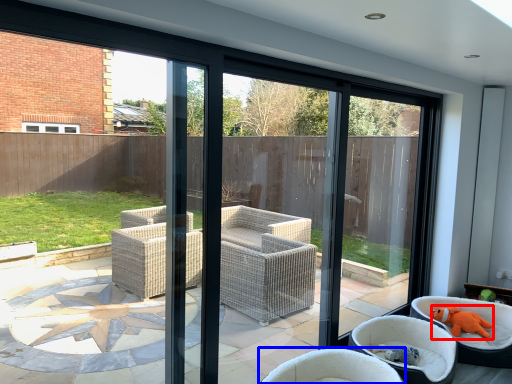
Question: Among these objects, which one is farthest to the camera, animal (highlighted by a red box) or chair (highlighted by a blue box)?

Choices:
 (A) animal
 (B) chair

Answer: (A)